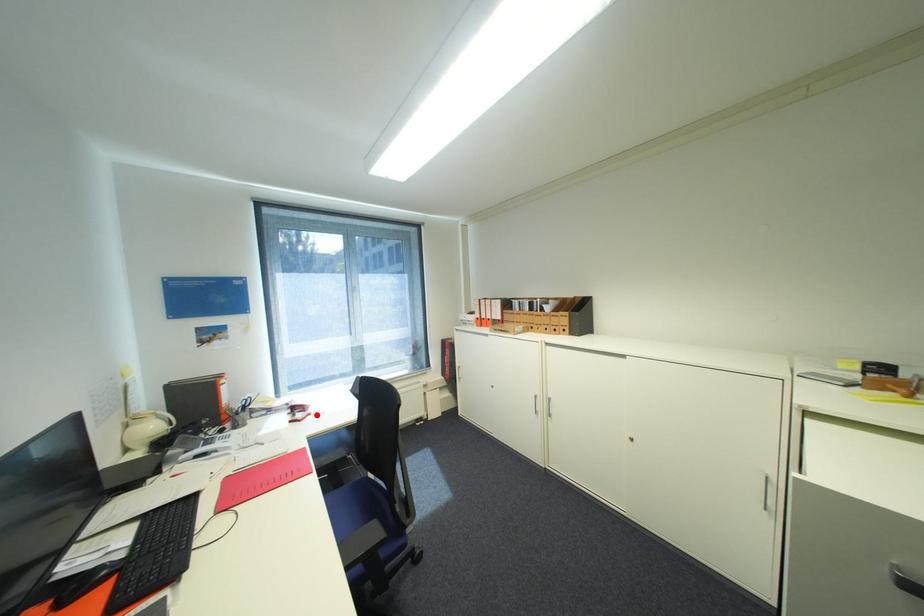
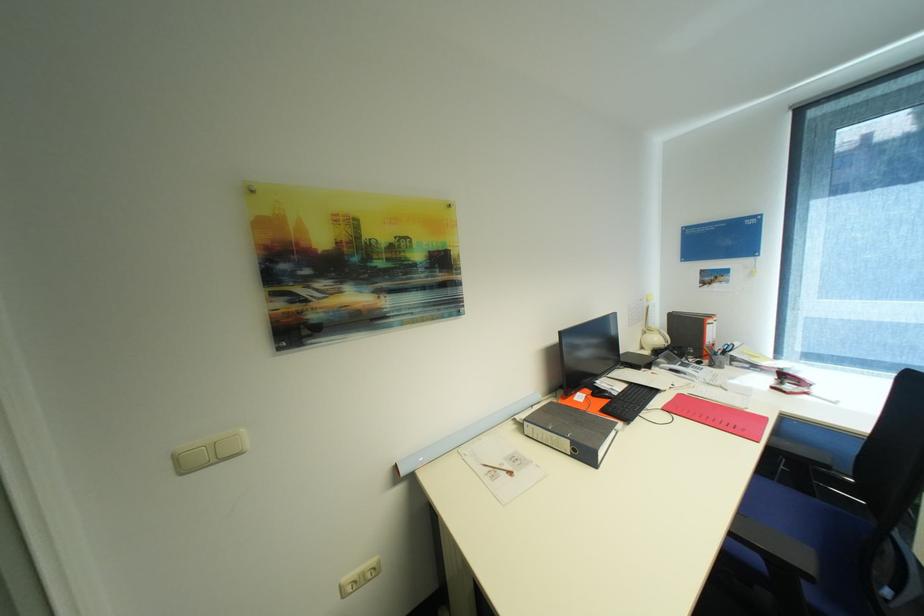
Where in the second image is the point corresponding to the highlighted location from the first image?

(813, 394)